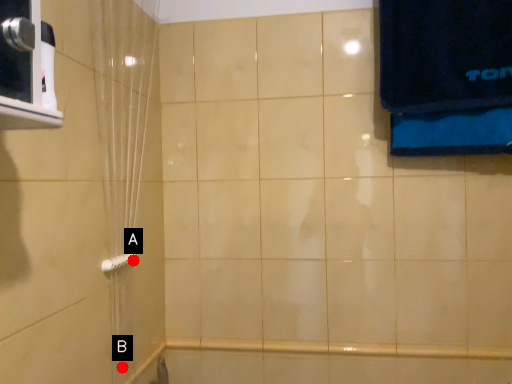
Question: Two points are circled on the image, labeled by A and B beside each circle. Which point is closer to the camera?

Choices:
 (A) A is closer
 (B) B is closer

Answer: (B)